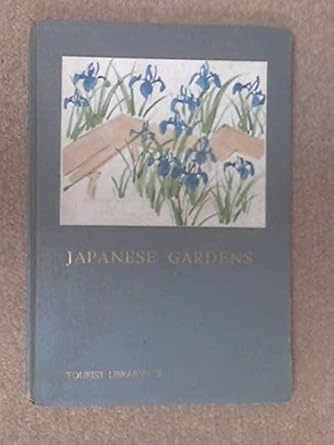
This screenshot has width=334, height=445. What are the coordinates of `table` in the screenshot? It's located at (311, 294).